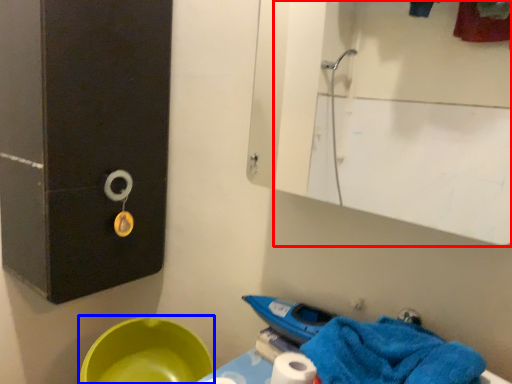
Question: Which object is closer to the camera taking this photo, mirror (highlighted by a red box) or basin (highlighted by a blue box)?

Choices:
 (A) mirror
 (B) basin

Answer: (A)